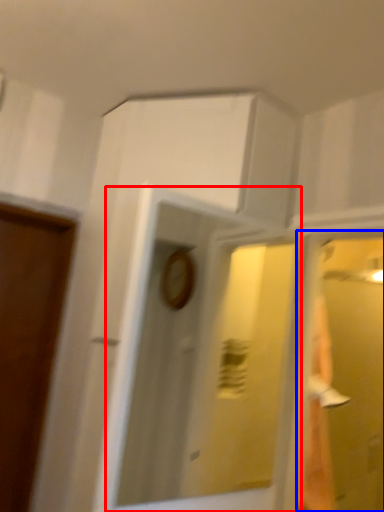
Question: Which of the following is the farthest to the observer, mirror (highlighted by a red box) or glass door (highlighted by a blue box)?

Choices:
 (A) mirror
 (B) glass door

Answer: (B)